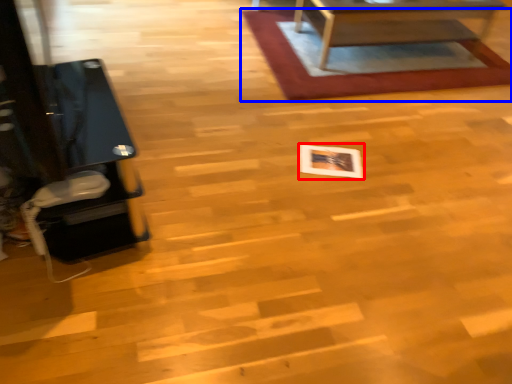
Question: Which point is further to the camera, square (highlighted by a red box) or mat (highlighted by a blue box)?

Choices:
 (A) square
 (B) mat

Answer: (B)